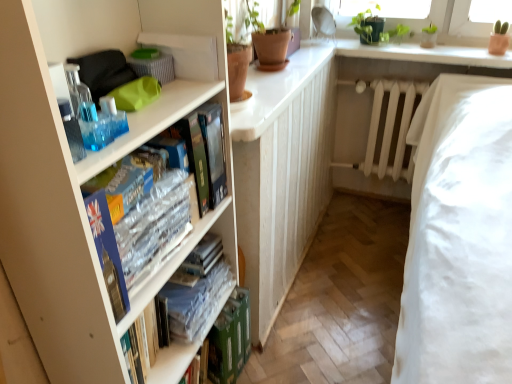
Question: Does white smooth window sill at upper center appear on the left side of clear plastic book at center, positioned as the 2th book in front-to-back order?

Choices:
 (A) yes
 (B) no

Answer: (B)

Question: Is white smooth window sill at upper center next to clear plastic book at center, which is counted as the second book, starting from the back, and touching it?

Choices:
 (A) yes
 (B) no

Answer: (B)

Question: Is white smooth window sill at upper center to the right of clear plastic book at center, placed as the 2th book when sorted from bottom to top, from the viewer's perspective?

Choices:
 (A) no
 (B) yes

Answer: (B)

Question: Can you confirm if white smooth window sill at upper center is smaller than clear plastic book at center, which is counted as the second book, starting from the back?

Choices:
 (A) no
 (B) yes

Answer: (A)

Question: From the image's perspective, is white smooth window sill at upper center on top of clear plastic book at center, placed as the 2th book when sorted from bottom to top?

Choices:
 (A) no
 (B) yes

Answer: (B)

Question: From a real-world perspective, is white smooth window sill at upper center located higher than clear plastic book at center, which is counted as the 2th book, starting from the top?

Choices:
 (A) yes
 (B) no

Answer: (A)

Question: Is white matte bookcase at left placed right next to translucent plastic bottles at left?

Choices:
 (A) no
 (B) yes

Answer: (A)

Question: Is translucent plastic bottles at left completely or partially inside white matte bookcase at left?

Choices:
 (A) yes
 (B) no

Answer: (A)

Question: From the image's perspective, is white matte bookcase at left below translucent plastic bottles at left?

Choices:
 (A) yes
 (B) no

Answer: (A)

Question: Is white matte bookcase at left positioned in front of translucent plastic bottles at left?

Choices:
 (A) yes
 (B) no

Answer: (A)

Question: From a real-world perspective, is white matte bookcase at left positioned under translucent plastic bottles at left based on gravity?

Choices:
 (A) yes
 (B) no

Answer: (A)

Question: Is white matte bookcase at left oriented away from translucent plastic bottles at left?

Choices:
 (A) yes
 (B) no

Answer: (A)

Question: Considering the relative sizes of clear plastic book at center, which is counted as the second book, starting from the back, and clear plastic books at center left, marked as the 3th book in a back-to-front arrangement, in the image provided, is clear plastic book at center, which is counted as the second book, starting from the back, taller than clear plastic books at center left, marked as the 3th book in a back-to-front arrangement,?

Choices:
 (A) no
 (B) yes

Answer: (A)